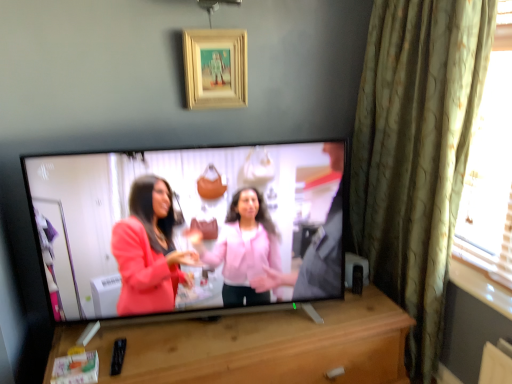
Question: Considering their positions, is green textured curtain at right located in front of or behind wooden cabinet at center?

Choices:
 (A) front
 (B) behind

Answer: (B)

Question: Is green textured curtain at right bigger or smaller than wooden cabinet at center?

Choices:
 (A) big
 (B) small

Answer: (B)

Question: Which of these objects is positioned farthest from the wooden picture frame at upper center?

Choices:
 (A) green textured curtain at right
 (B) wooden cabinet at center
 (C) matte black tv at center

Answer: (B)

Question: Considering the real-world distances, which object is farthest from the wooden picture frame at upper center?

Choices:
 (A) green textured curtain at right
 (B) matte black tv at center
 (C) wooden cabinet at center

Answer: (C)